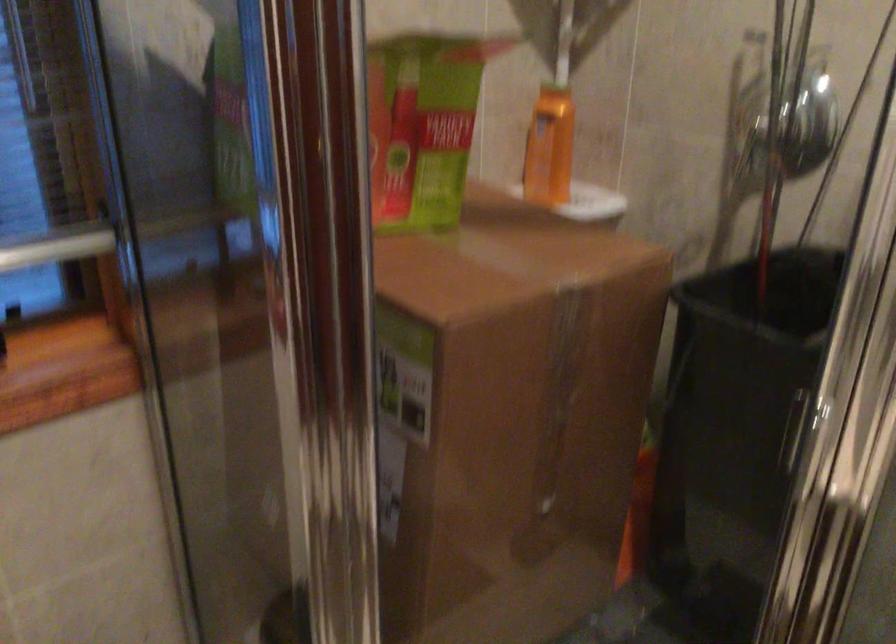
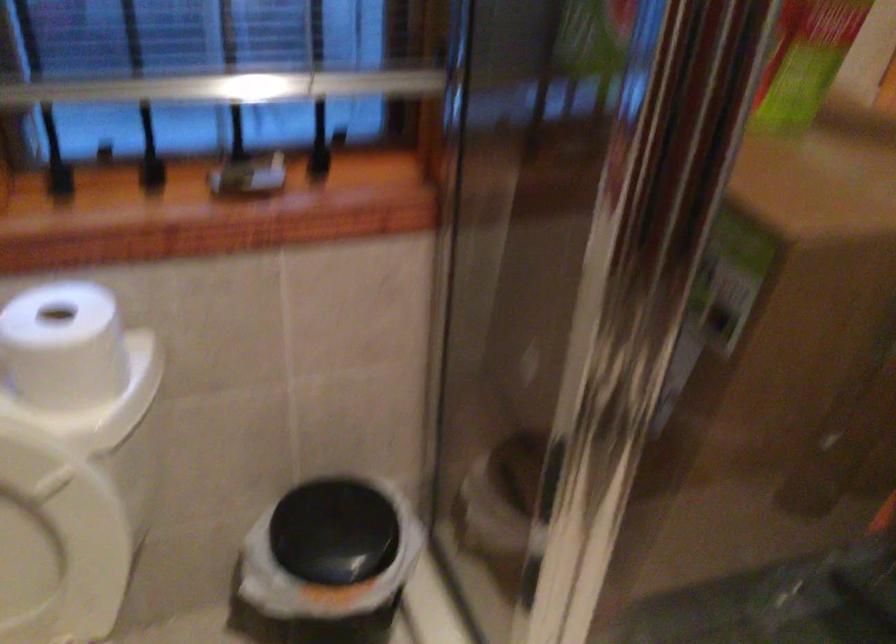
Question: The images are taken continuously from a first-person perspective. In which direction are you moving?

Choices:
 (A) Left
 (B) Right
 (C) Forward
 (D) Backward

Answer: (A)